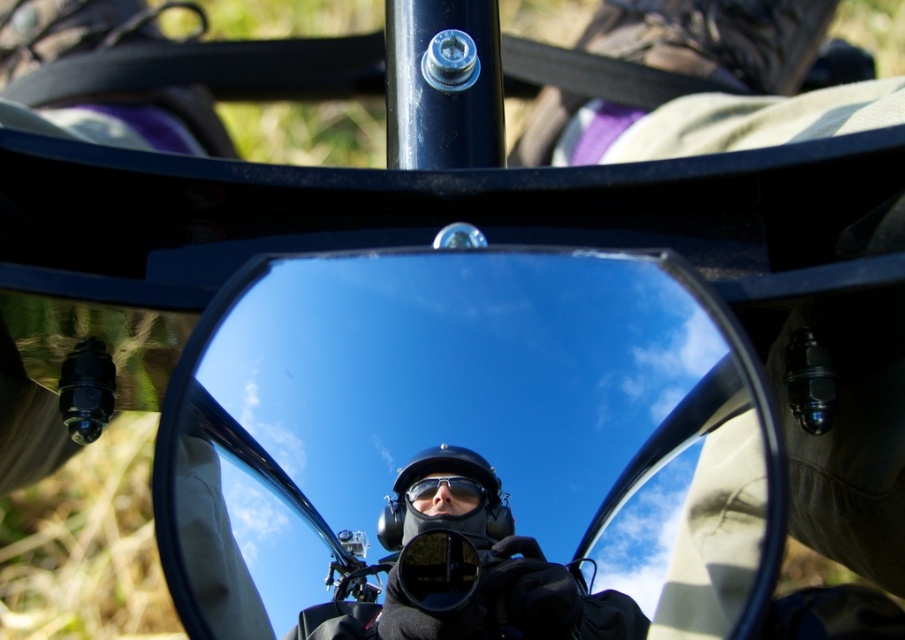
Which is behind, point (378, 388) or point (491, 524)?

Point (378, 388)

How distant is glossy black mirror at center from black matte helmet at center?

glossy black mirror at center and black matte helmet at center are 1.45 inches apart from each other.

Between point (270, 476) and point (403, 468), which one is positioned in front?

Point (403, 468) is in front.

Find the location of `glossy black mirror at center`. glossy black mirror at center is located at coordinates (469, 451).

Is black matte helmet at center taller than matte black goggles at center?

Yes, black matte helmet at center is taller than matte black goggles at center.

Identify the location of black matte helmet at center. The height and width of the screenshot is (640, 905). (459, 573).

Where is `black matte helmet at center`? black matte helmet at center is located at coordinates (459, 573).

Which of these two, glossy black mirror at center or matte black goggles at center, stands shorter?

matte black goggles at center is shorter.

Does glossy black mirror at center have a lesser width compared to matte black goggles at center?

No.

Does point (282, 596) come behind point (473, 481)?

That is False.

I want to click on glossy black mirror at center, so tap(469, 451).